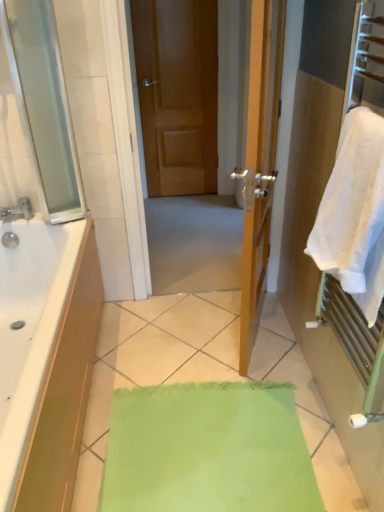
Question: Is point (357, 285) closer or farther from the camera than point (14, 214)?

Choices:
 (A) farther
 (B) closer

Answer: (B)

Question: From a real-world perspective, is white fluffy towel at right physically located above or below brushed metal faucet at left?

Choices:
 (A) below
 (B) above

Answer: (B)

Question: Considering the real-world distances, which object is farthest from the brushed metal faucet at left?

Choices:
 (A) matte wooden door at center
 (B) white fluffy towel at right

Answer: (A)

Question: Which object is the closest to the white fluffy towel at right?

Choices:
 (A) brushed metal faucet at left
 (B) matte wooden door at center

Answer: (A)